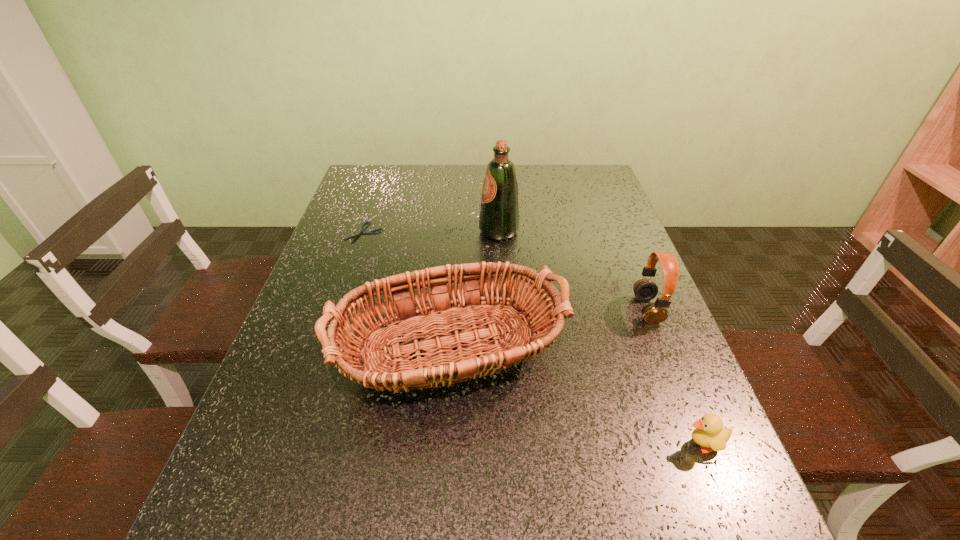
Locate an element on the screen. vacant space at the far edge is located at coordinates (459, 187).

The image size is (960, 540). In the image, there is a desktop. Identify the location of free region at the left edge. (306, 295).

This screenshot has width=960, height=540. In the image, there is a desktop. What are the coordinates of `vacant area at the right edge` in the screenshot? It's located at 612,206.

At what (x,y) coordinates should I click in order to perform the action: click on free spot between the olive oil and the shortest object. Please return your answer as a coordinate pair (x, y). This screenshot has height=540, width=960. Looking at the image, I should click on (431, 232).

The image size is (960, 540). What are the coordinates of `free spot between the olive oil and the third shortest object` in the screenshot? It's located at (573, 271).

Locate an element on the screen. Image resolution: width=960 pixels, height=540 pixels. vacant area between the tallest object and the headset is located at coordinates (573, 271).

Image resolution: width=960 pixels, height=540 pixels. I want to click on free space between the headset and the tallest object, so click(x=573, y=271).

At what (x,y) coordinates should I click in order to perform the action: click on vacant space that is in between the basket and the second shortest object. Please return your answer as a coordinate pair (x, y). The height and width of the screenshot is (540, 960). Looking at the image, I should click on (570, 401).

The width and height of the screenshot is (960, 540). What are the coordinates of `object that stands as the fourth closest to the shortest object` in the screenshot? It's located at (709, 433).

Locate which object ranks second in proximity to the basket. Please provide its 2D coordinates. Your answer should be formatted as a tuple, i.e. [(x, y)], where the tuple contains the x and y coordinates of a point satisfying the conditions above.

[(645, 289)]